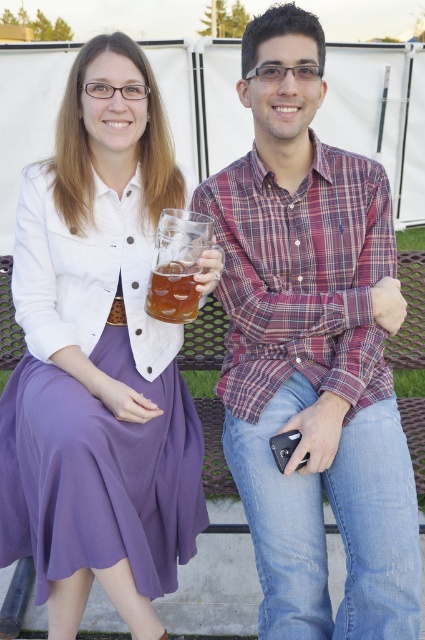
Question: Which point is farther to the camera?

Choices:
 (A) (82, 285)
 (B) (226, 448)

Answer: (A)

Question: Which of the following is the farthest from the observer?

Choices:
 (A) (44, 308)
 (B) (285, 572)
 (C) (161, 269)

Answer: (A)

Question: Considering the relative positions of matte glass mug at left and translucent glass mug at center in the image provided, where is matte glass mug at left located with respect to translucent glass mug at center?

Choices:
 (A) below
 (B) above

Answer: (A)

Question: Is matte glass mug at left to the left of translucent glass mug at center from the viewer's perspective?

Choices:
 (A) no
 (B) yes

Answer: (B)

Question: Does plaid shirt at center have a greater width compared to matte glass mug at left?

Choices:
 (A) yes
 (B) no

Answer: (A)

Question: Which object is the closest to the translucent glass mug at center?

Choices:
 (A) matte glass mug at left
 (B) plaid shirt at center

Answer: (A)